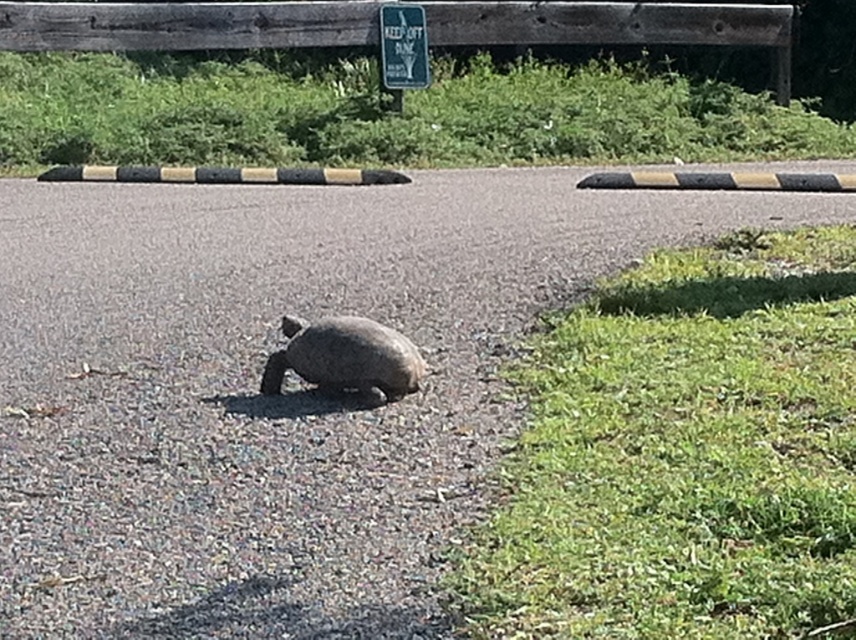
You are a driver approaching the road and see the brown matte tortoise at center and the green plastic sign at upper center. Which object is closer to the ground?

The brown matte tortoise at center is shorter than the green plastic sign at upper center, so the brown matte tortoise at center is closer to the ground.

You are a delivery driver who needs to safely pass through the road while avoiding the brown matte tortoise at center and the green plastic sign at upper center. Which object should you avoid first based on their size?

The brown matte tortoise at center occupies less space than the green plastic sign at upper center, so you should prioritize avoiding the larger green plastic sign at upper center first as it takes up more space on the road.

You are a pedestrian who wants to cross the road safely. You see the brown matte tortoise at center and the green plastic sign at upper center. Which object is closer to the ground?

The brown matte tortoise at center is closer to the ground because it is below the green plastic sign at upper center.